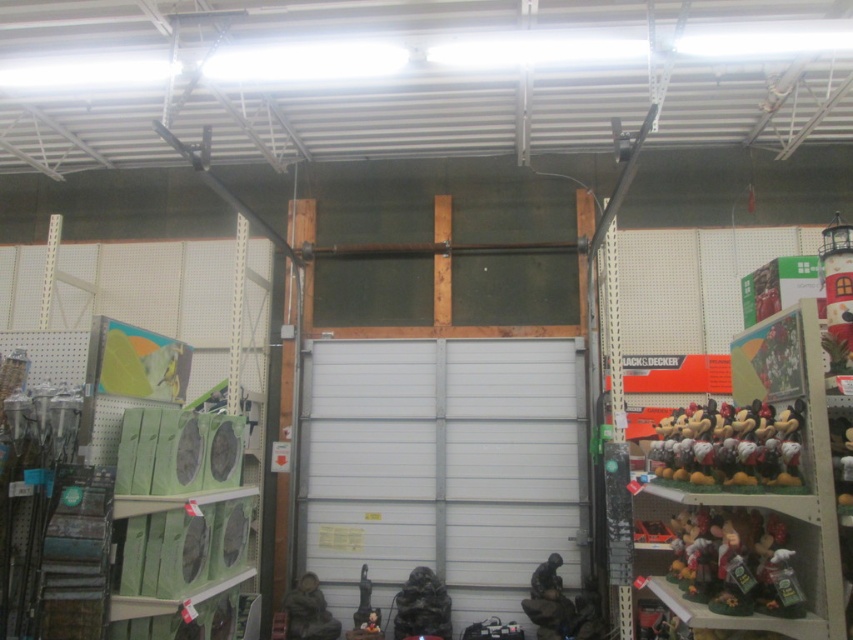
You are a customer in the store and you want to know which object is taller between the metallic figure at lower center and the metallic bronze statue at lower center. Can you tell me?

The metallic figure at lower center is taller than the metallic bronze statue at lower center according to the description.

You are standing in the hardware store and see two points marked on the wall. The first point is at coordinates point (477, 387) and the second is at point (737, 515). Which point is closer to you?

Point (477, 387) is closer to you because it is further to the viewer than point (737, 515).

You are a customer in the hardware store and need to determine which object is taller between the white matte garage door at center and the matte brown figurine at lower right. Based on their positions in the image, which one is taller?

The white matte garage door at center is taller than the matte brown figurine at lower right according to the description.